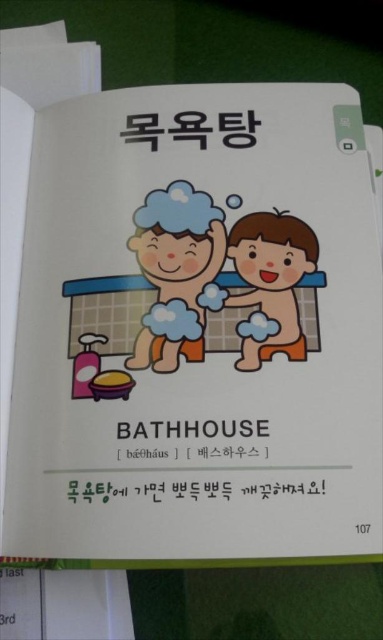
You are a parent trying to reach the matte blue sponge at center for your child. You are currently standing 1 meter away from the bathtub. Can you reach the sponge without moving closer?

The matte blue sponge at center is 74.93 centimeters away from viewer. Since you are standing 1 meter away, which is 100 centimeters, you can reach it without moving closer because the sponge is closer than your current distance.

You are a child trying to reach both the matte blue sponge at center and the smooth orange sponge at center in the bathhouse scene. Which sponge can you grab first without moving the other?

The matte blue sponge at center can be grabbed first because the smooth orange sponge at center is behind it, making it more accessible.

You are a child in the bathhouse scene. You want to choose the bigger sponge between the matte blue sponge at center and the smooth orange sponge at center to wash your back. Which one should you pick?

The matte blue sponge at center is larger in size than the smooth orange sponge at center, so you should pick the matte blue sponge at center to wash your back.